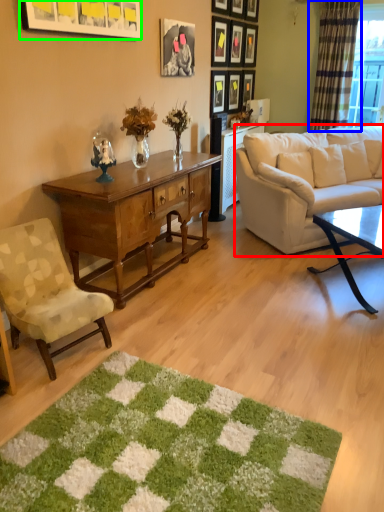
Question: Based on their relative distances, which object is farther from studio couch (highlighted by a red box)? Choose from curtain (highlighted by a blue box) and picture frame (highlighted by a green box).

Choices:
 (A) curtain
 (B) picture frame

Answer: (A)